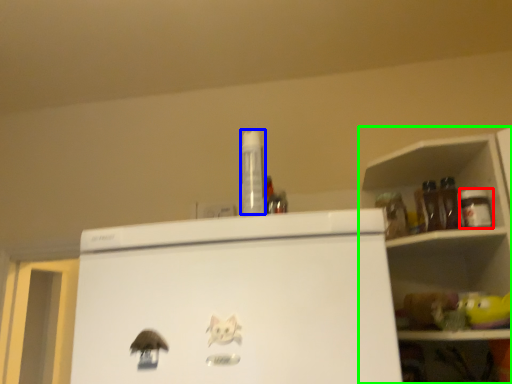
Question: Based on their relative distances, which object is nearer to bottle (highlighted by a red box)? Choose from bottle (highlighted by a blue box) and shelf (highlighted by a green box).

Choices:
 (A) bottle
 (B) shelf

Answer: (B)